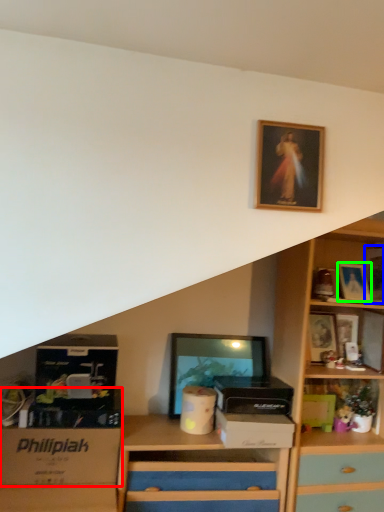
Question: Based on their relative distances, which object is nearer to storage box (highlighted by a red box)? Choose from picture frame (highlighted by a blue box) and picture frame (highlighted by a green box).

Choices:
 (A) picture frame
 (B) picture frame

Answer: (B)